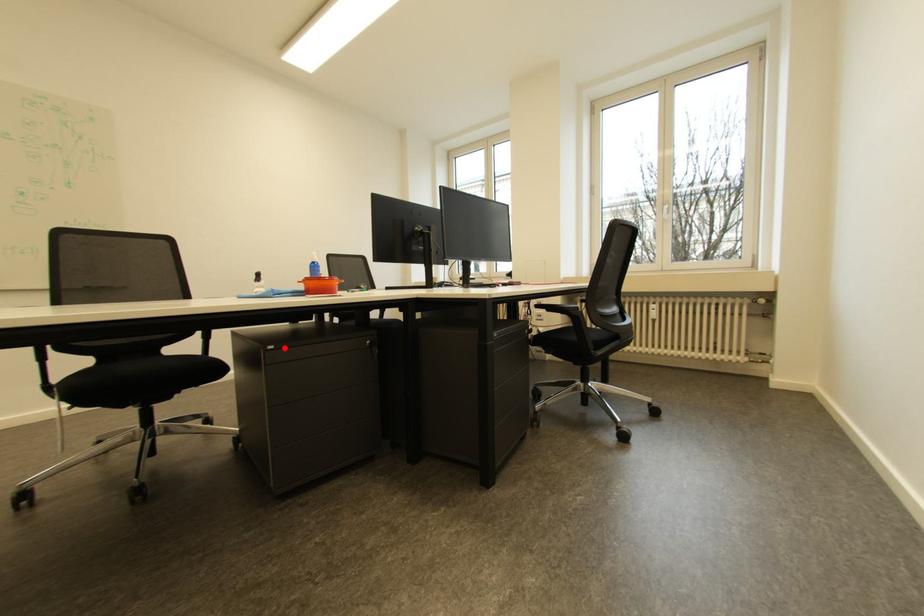
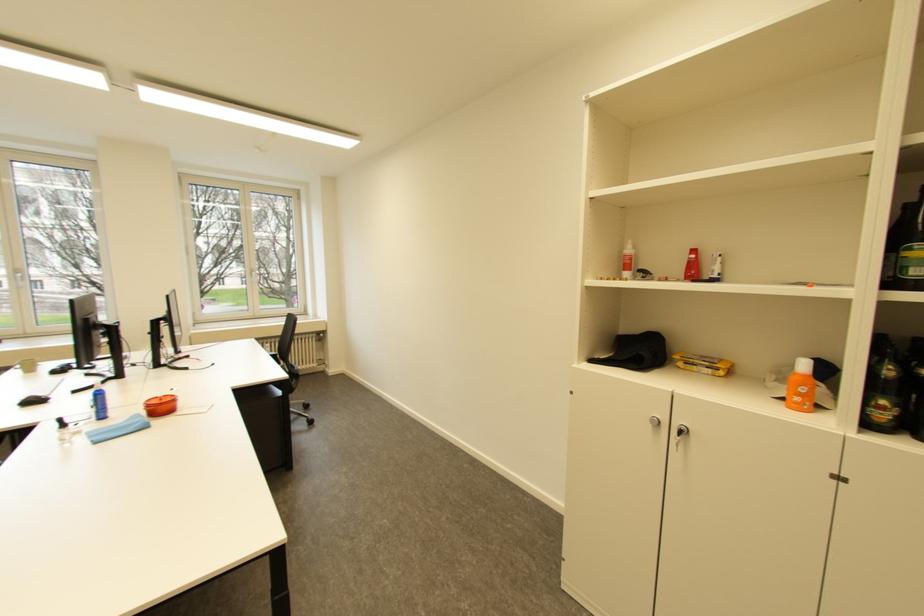
Question: I am providing you with two images of the same scene from different viewpoints. A red point is marked on the first image. Can you still see the location of the red point in image 2?

Choices:
 (A) Yes
 (B) No

Answer: (B)